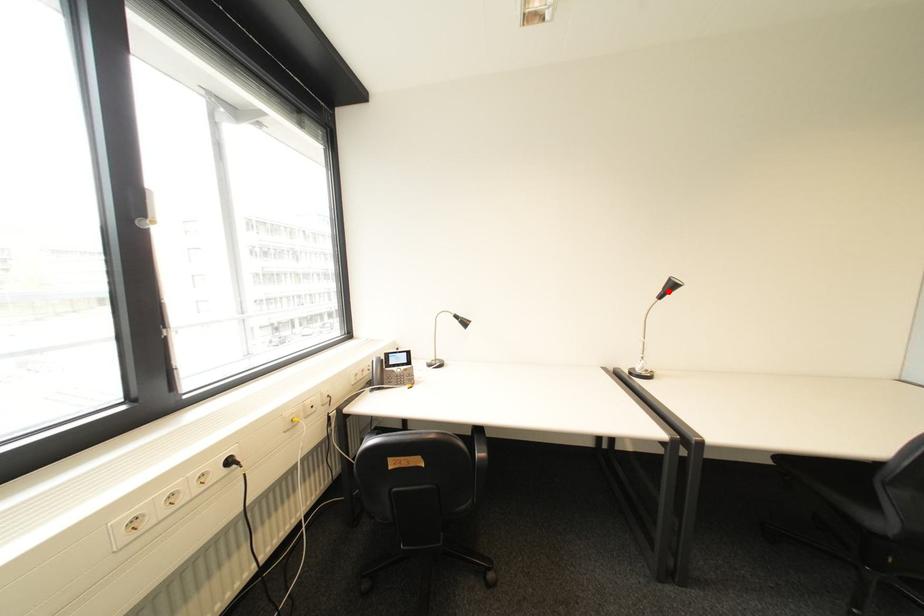
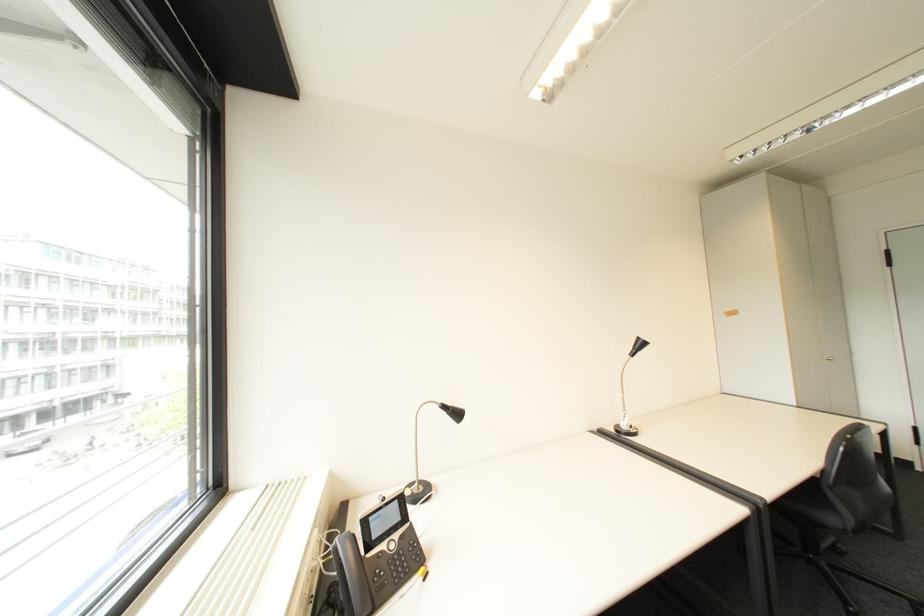
Question: I am providing you with two images of the same scene from different viewpoints. A red point is marked on the first image. At the location where the point appears in image 1, is it still visible in image 2?

Choices:
 (A) Yes
 (B) No

Answer: (A)